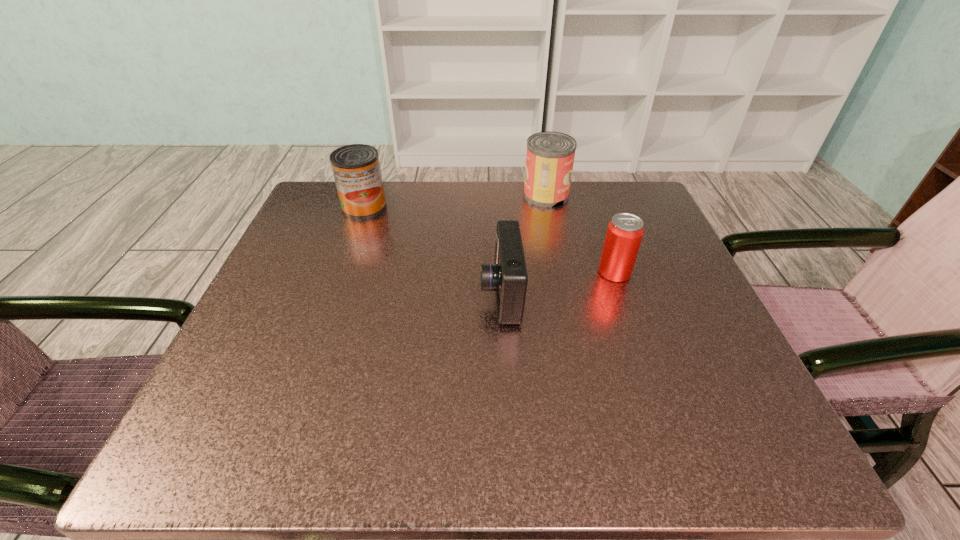
In order to click on blank space located on the front-facing side of the camera in this screenshot , I will do `click(298, 294)`.

Locate an element on the screen. The width and height of the screenshot is (960, 540). object that is at the left edge is located at coordinates (356, 168).

Where is `object present at the right edge`? object present at the right edge is located at coordinates (624, 234).

Find the location of a particular element. The width and height of the screenshot is (960, 540). object that is at the far left corner is located at coordinates (356, 168).

Where is `free location at the far edge`? free location at the far edge is located at coordinates (525, 219).

Locate an element on the screen. vacant space at the near edge of the desktop is located at coordinates (534, 437).

Where is `free region at the left edge`? free region at the left edge is located at coordinates (285, 369).

Image resolution: width=960 pixels, height=540 pixels. In order to click on free space at the right edge of the desktop in this screenshot , I will do `click(709, 307)`.

Locate an element on the screen. The width and height of the screenshot is (960, 540). vacant space at the far right corner of the desktop is located at coordinates (612, 211).

Identify the location of vacant space at the near right corner of the desktop. This screenshot has width=960, height=540. (653, 415).